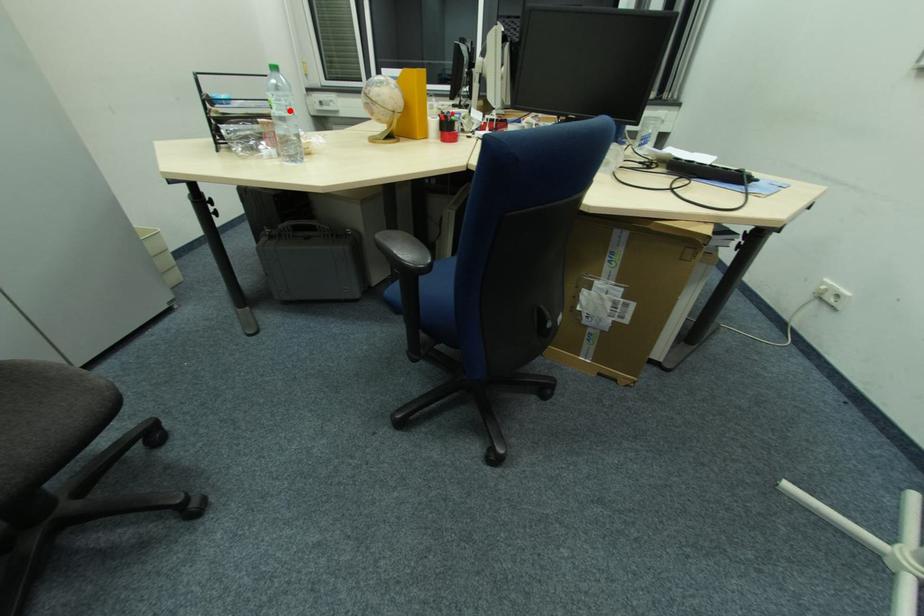
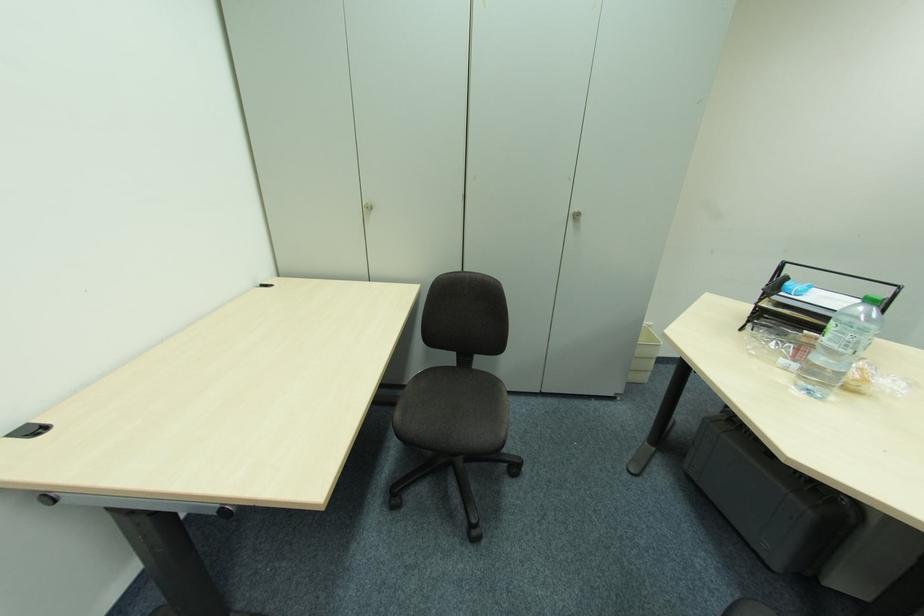
The point at the highlighted location is marked in the first image. Where is the corresponding point in the second image?

(850, 347)